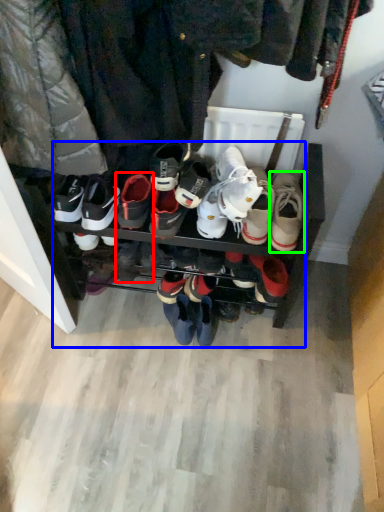
Question: Which is farther away from footwear (highlighted by a red box)? footwear (highlighted by a blue box) or footwear (highlighted by a green box)?

Choices:
 (A) footwear
 (B) footwear

Answer: (B)